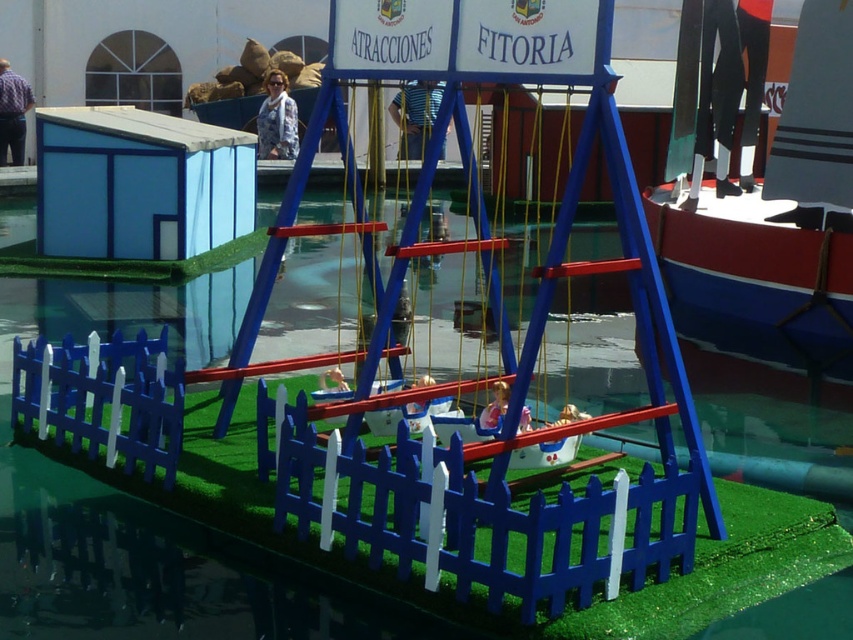
Question: Which point is closer to the camera?

Choices:
 (A) (799, 168)
 (B) (457, 83)

Answer: (B)

Question: Which object appears farthest from the camera in this image?

Choices:
 (A) blue painted wood picket fence at center
 (B) red and blue painted wooden boat at right
 (C) matte blue swing at center

Answer: (B)

Question: Is blue painted wood picket fence at center below red and blue painted wooden boat at right?

Choices:
 (A) no
 (B) yes

Answer: (B)

Question: Does red and blue painted wooden boat at right appear on the left side of matte blue swing at center?

Choices:
 (A) yes
 (B) no

Answer: (B)

Question: Is blue painted wood picket fence at center bigger than matte blue swing at center?

Choices:
 (A) no
 (B) yes

Answer: (A)

Question: Considering the real-world distances, which object is closest to the matte blue swing at center?

Choices:
 (A) blue painted wood picket fence at center
 (B) red and blue painted wooden boat at right

Answer: (A)